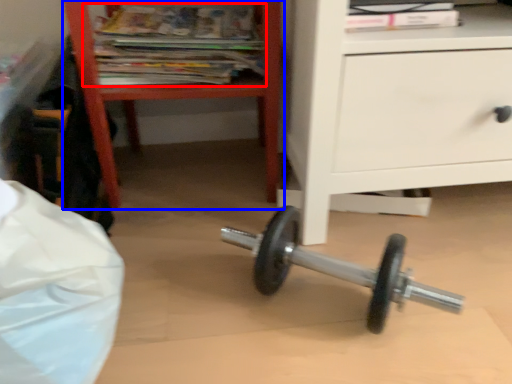
Question: Which point is further to the camera, magazine (highlighted by a red box) or furniture (highlighted by a blue box)?

Choices:
 (A) magazine
 (B) furniture

Answer: (A)